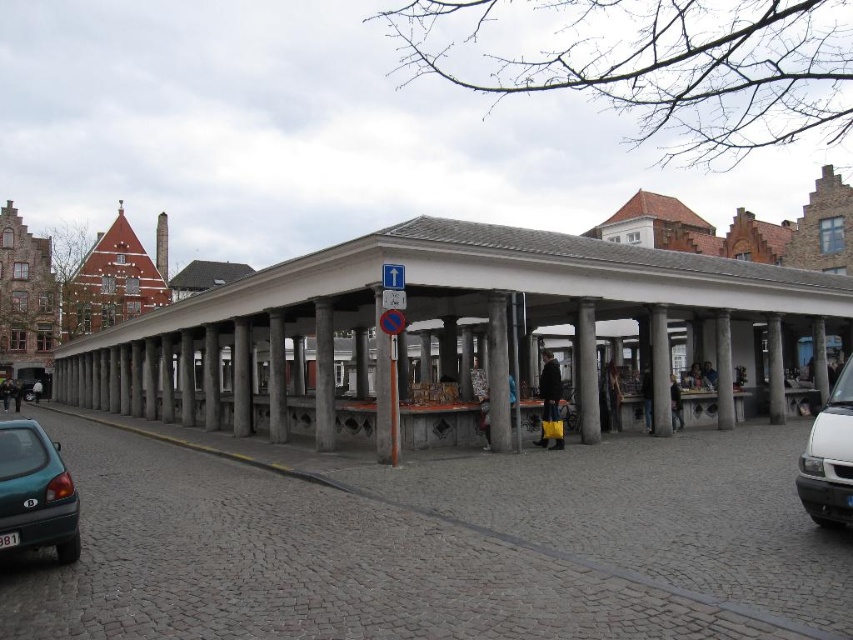
Does concrete pillars at center lie in front of teal matte car at lower left?

No, it is not.

Does point (228, 323) come farther from viewer compared to point (39, 508)?

Yes.

Locate an element on the screen. The height and width of the screenshot is (640, 853). concrete pillars at center is located at coordinates coord(439,326).

Is teal matte car at lower left to the right of white matte van at lower right from the viewer's perspective?

Incorrect, teal matte car at lower left is not on the right side of white matte van at lower right.

Who is more distant from viewer, (16,509) or (831,525)?

Point (831,525)

This screenshot has height=640, width=853. I want to click on teal matte car at lower left, so coord(35,492).

Is concrete pillars at center further to the viewer compared to white matte van at lower right?

That is True.

Does concrete pillars at center have a larger size compared to white matte van at lower right?

Yes.

Between point (438, 256) and point (822, 518), which one is positioned in front?

Positioned in front is point (822, 518).

In order to click on concrete pillars at center in this screenshot , I will do `click(439, 326)`.